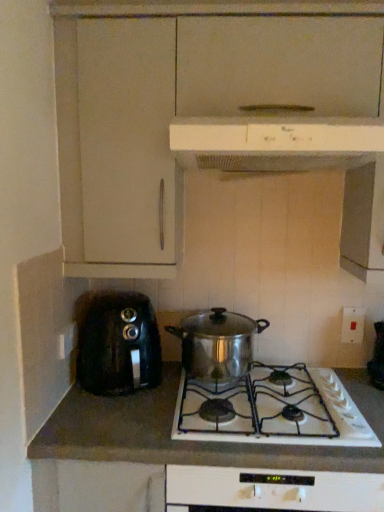
Question: Does white glossy stove at center have a lesser height compared to stainless steel pot at center, positioned as the second kitchen appliance in top-to-bottom order?

Choices:
 (A) yes
 (B) no

Answer: (B)

Question: Is white glossy stove at center at the left side of stainless steel pot at center, positioned as the second kitchen appliance in top-to-bottom order?

Choices:
 (A) no
 (B) yes

Answer: (A)

Question: Is white glossy stove at center completely or partially outside of stainless steel pot at center, placed as the first kitchen appliance when sorted from bottom to top?

Choices:
 (A) no
 (B) yes

Answer: (B)

Question: Is white glossy stove at center aimed at stainless steel pot at center, positioned as the second kitchen appliance in top-to-bottom order?

Choices:
 (A) yes
 (B) no

Answer: (B)

Question: From the image's perspective, does white glossy stove at center appear lower than stainless steel pot at center, positioned as the second kitchen appliance in top-to-bottom order?

Choices:
 (A) no
 (B) yes

Answer: (B)

Question: Are white glossy stove at center and stainless steel pot at center, placed as the first kitchen appliance when sorted from bottom to top, located far from each other?

Choices:
 (A) no
 (B) yes

Answer: (A)

Question: Does white glossy stove at center lie behind white plastic switch at right, which appears as the second electric outlet when viewed from the left?

Choices:
 (A) no
 (B) yes

Answer: (A)

Question: Is white glossy stove at center far from white plastic switch at right, the first electric outlet in the right-to-left sequence?

Choices:
 (A) yes
 (B) no

Answer: (B)

Question: Is white plastic switch at right, which appears as the second electric outlet when viewed from the left, inside white glossy stove at center?

Choices:
 (A) no
 (B) yes

Answer: (A)

Question: Can you confirm if white glossy stove at center is smaller than white plastic switch at right, the 2th electric outlet viewed from the front?

Choices:
 (A) yes
 (B) no

Answer: (B)

Question: Is white glossy stove at center looking in the opposite direction of white plastic switch at right, which appears as the second electric outlet when viewed from the left?

Choices:
 (A) yes
 (B) no

Answer: (B)

Question: Considering the relative positions of white glossy stove at center and white plastic switch at right, the 2th electric outlet viewed from the front, in the image provided, is white glossy stove at center to the right of white plastic switch at right, the 2th electric outlet viewed from the front, from the viewer's perspective?

Choices:
 (A) no
 (B) yes

Answer: (A)

Question: From the image's perspective, is white glossy stove at center beneath white plastic range hood at upper center, the second kitchen appliance in the bottom-to-top sequence?

Choices:
 (A) yes
 (B) no

Answer: (A)